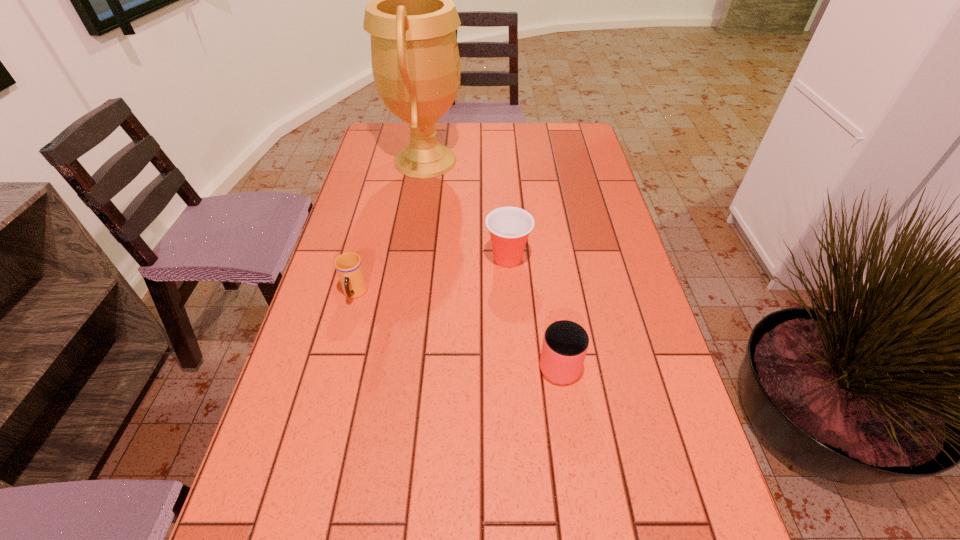
You are a GUI agent. You are given a task and a screenshot of the screen. Output one action in this format:
    pyautogui.click(x=<x>, y=<y>)
    Task: Click on the vacant region that satisfies the following two spatial constraints: 1. on the engravings side of the third nearest object; 2. on the right side of the tallest object
    
    Given the screenshot: What is the action you would take?
    pyautogui.click(x=410, y=259)